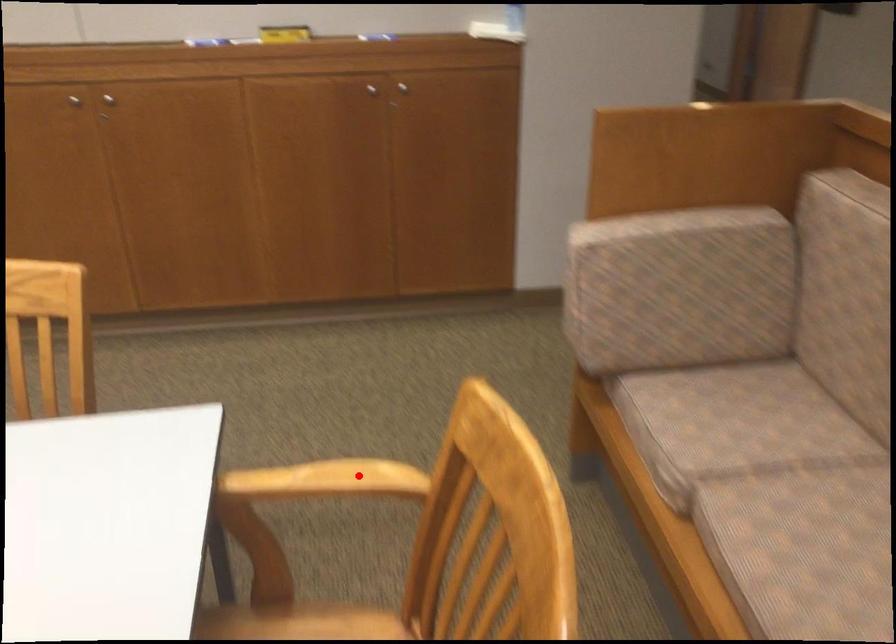
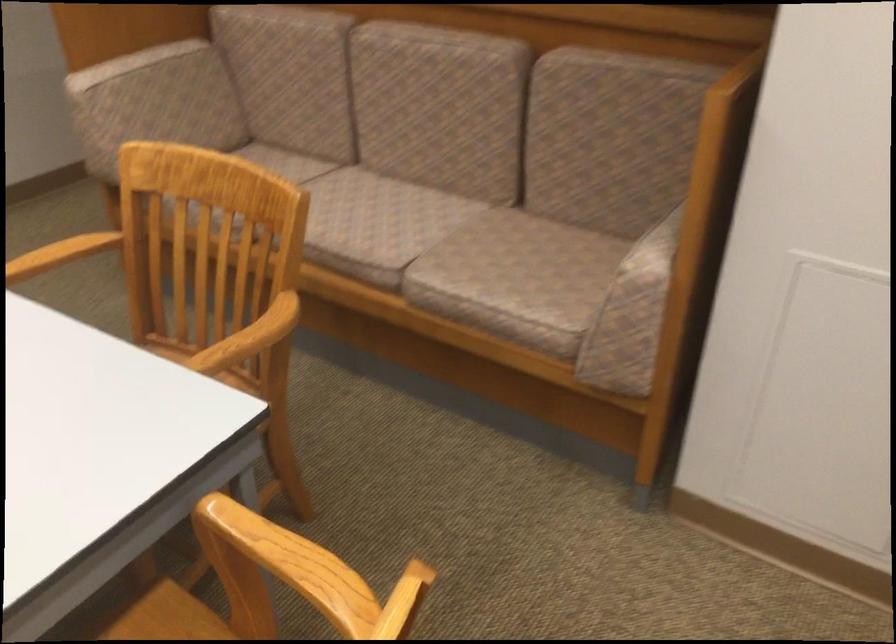
Locate, in the second image, the point that corresponds to the highlighted location in the first image.

(62, 252)